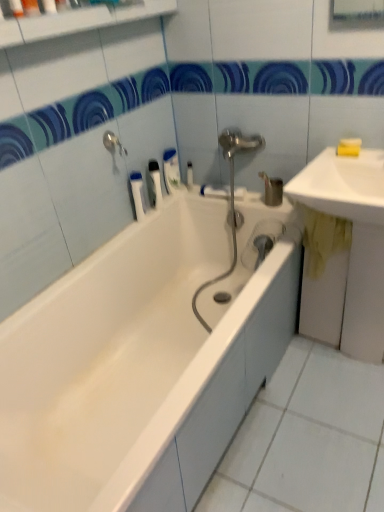
Image resolution: width=384 pixels, height=512 pixels. I want to click on free space in front of yellow matte soap at upper right, the second soap viewed from the top, so click(x=354, y=163).